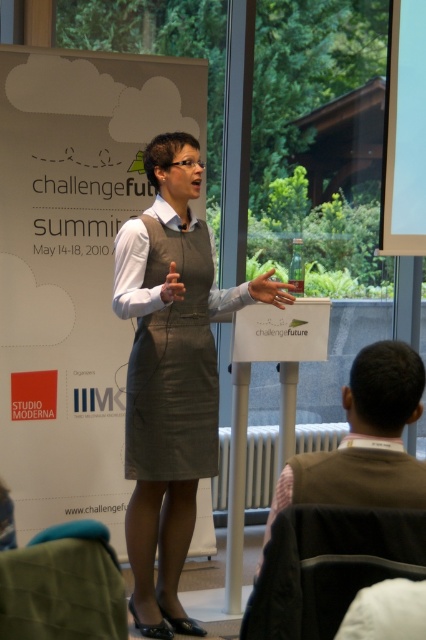
In the scene shown: You are an event coordinator planning to take a photo of the speaker. The camera you are using has a focus range that can only accommodate objects up to the size of the brown fabric vest at lower right. Will the matte gray dress at center be in focus?

The matte gray dress at center has a larger size compared to brown fabric vest at lower right. Since the camera can only accommodate objects up to the size of the brown fabric vest at lower right, the matte gray dress at center may not be fully in focus.

In the scene shown: You are an event organizer who needs to ensure all clothing items in the image are visible to the audience. Given that the gray leather dress at center and the brown fabric vest at lower right are both on display, which one is more likely to be seen by the audience due to its position?

The gray leather dress at center is much taller than the brown fabric vest at lower right, so it is more likely to be seen by the audience.